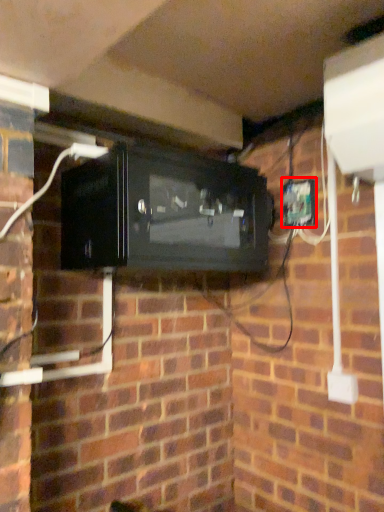
Question: From the image's perspective, considering the relative positions of electric outlet (annotated by the red box) and appliance in the image provided, where is electric outlet (annotated by the red box) located with respect to the staircase?

Choices:
 (A) above
 (B) below

Answer: (A)